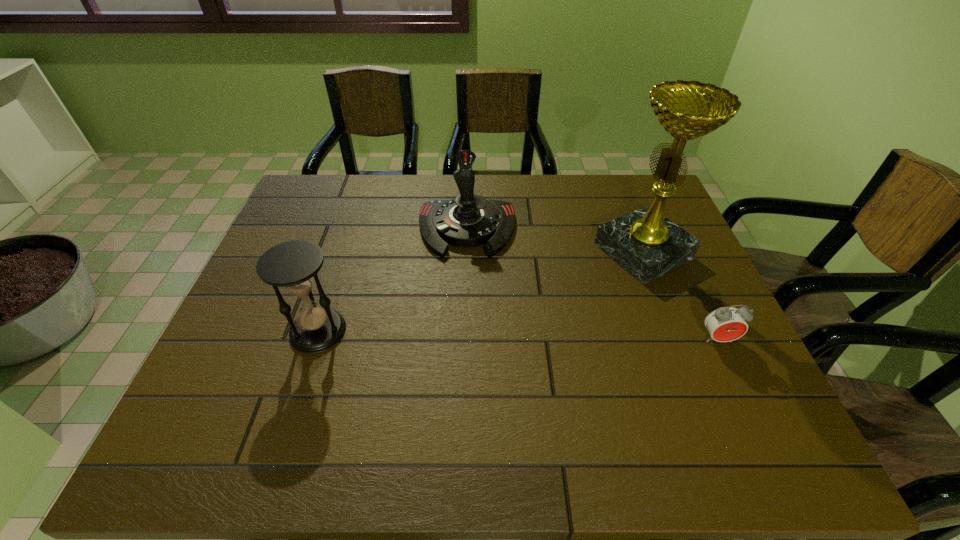
Locate an element on the screen. vacant space on the desktop that is between the leftmost object and the shortest object and is positioned on the handle side of the second object from left to right is located at coordinates (463, 334).

Where is `free space on the desktop that is between the leftmost object and the shortest object and is positioned on the front-facing side of the tallest object`? This screenshot has height=540, width=960. free space on the desktop that is between the leftmost object and the shortest object and is positioned on the front-facing side of the tallest object is located at coordinates (468, 334).